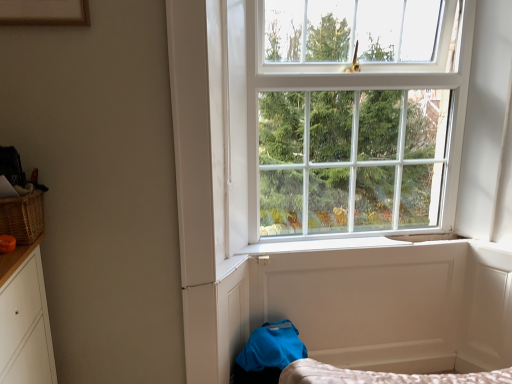
Question: Does white smooth window sill at center have a smaller size compared to woven brown basket at left?

Choices:
 (A) yes
 (B) no

Answer: (A)

Question: From the image's perspective, is white smooth window sill at center below woven brown basket at left?

Choices:
 (A) yes
 (B) no

Answer: (A)

Question: Does white smooth window sill at center contain woven brown basket at left?

Choices:
 (A) no
 (B) yes

Answer: (A)

Question: From a real-world perspective, is white smooth window sill at center on woven brown basket at left?

Choices:
 (A) yes
 (B) no

Answer: (B)

Question: Can you confirm if white smooth window sill at center is shorter than woven brown basket at left?

Choices:
 (A) no
 (B) yes

Answer: (B)

Question: Considering the relative positions of white smooth window sill at center and woven brown basket at left in the image provided, is white smooth window sill at center to the left of woven brown basket at left from the viewer's perspective?

Choices:
 (A) no
 (B) yes

Answer: (A)

Question: Would you say white smooth window sill at center is part of woven brown basket at left's contents?

Choices:
 (A) no
 (B) yes

Answer: (A)

Question: Is the depth of woven brown basket at left greater than that of white smooth window sill at center?

Choices:
 (A) yes
 (B) no

Answer: (B)

Question: Are woven brown basket at left and white smooth window sill at center far apart?

Choices:
 (A) no
 (B) yes

Answer: (B)

Question: Considering the relative sizes of woven brown basket at left and white smooth window sill at center in the image provided, is woven brown basket at left taller than white smooth window sill at center?

Choices:
 (A) yes
 (B) no

Answer: (A)

Question: Considering the relative sizes of woven brown basket at left and white smooth window sill at center in the image provided, is woven brown basket at left thinner than white smooth window sill at center?

Choices:
 (A) yes
 (B) no

Answer: (B)

Question: Can you confirm if woven brown basket at left is positioned to the right of white smooth window sill at center?

Choices:
 (A) no
 (B) yes

Answer: (A)

Question: From a real-world perspective, is woven brown basket at left located beneath white wooden window at upper center?

Choices:
 (A) yes
 (B) no

Answer: (A)